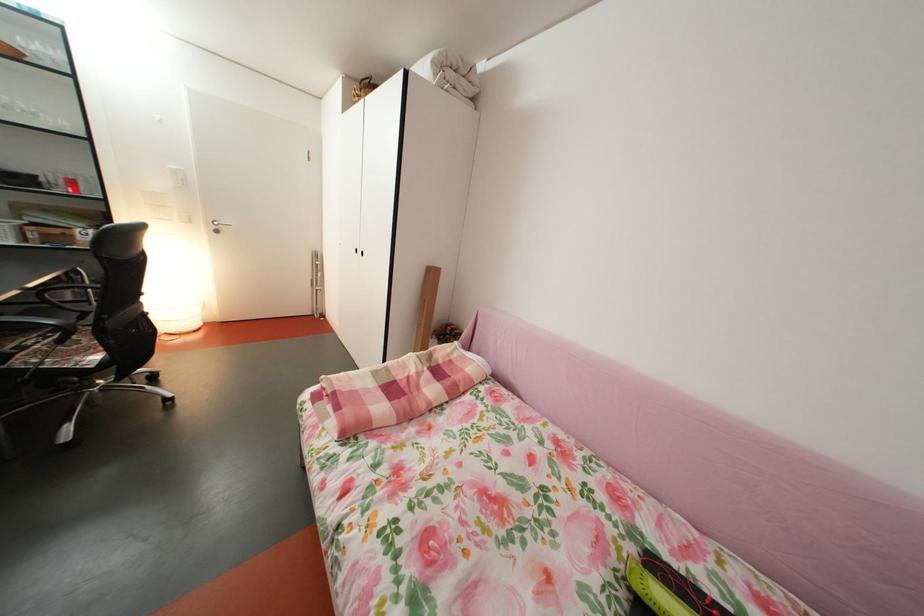
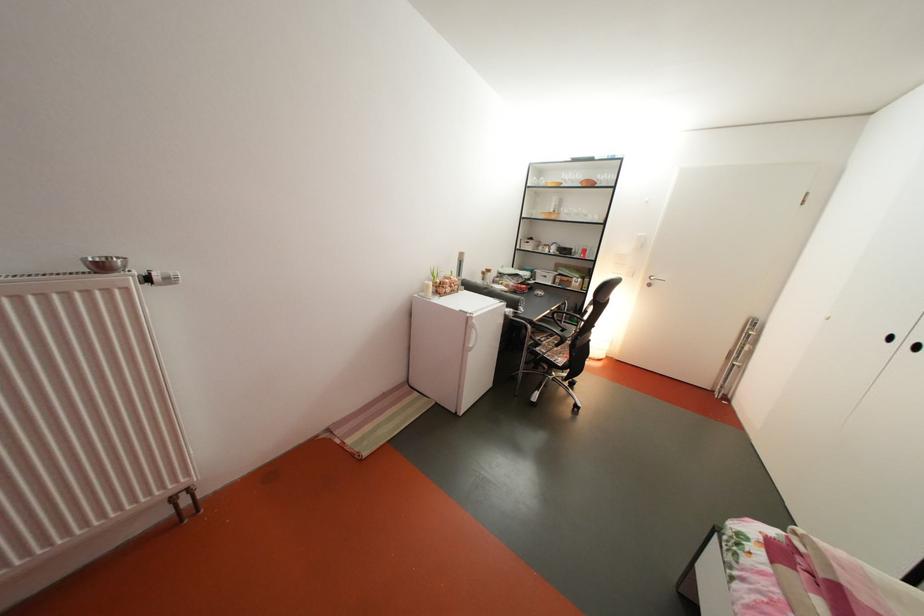
Locate, in the second image, the point that corresponds to the highlighted location in the first image.

(591, 257)